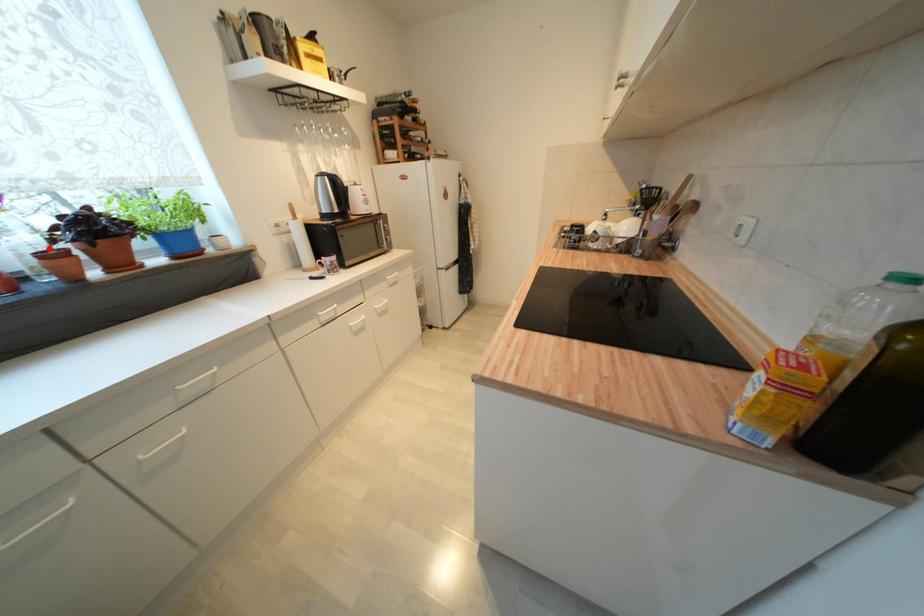
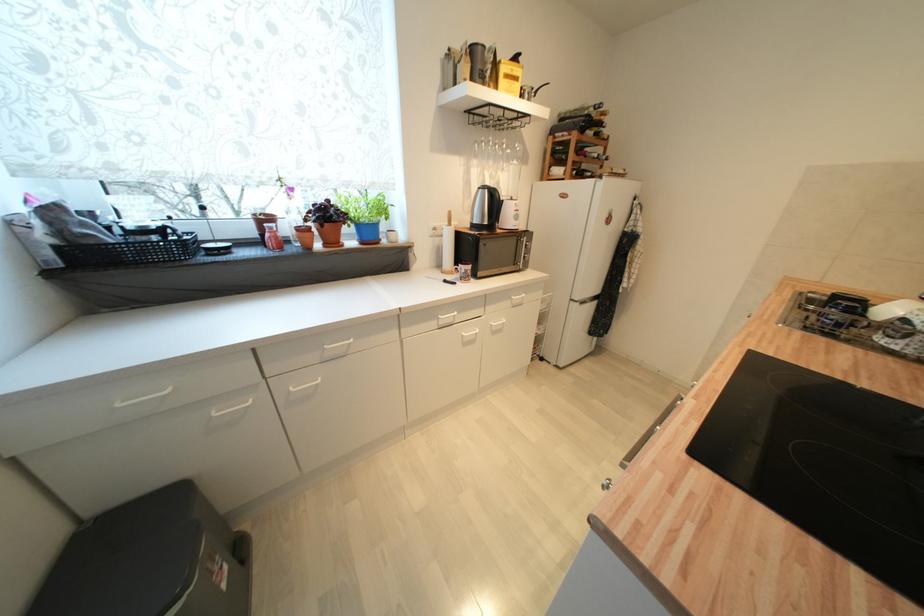
Question: I am providing you with two images of the same scene from different viewpoints. Image1 has a red point marked. In image2, the corresponding 3D location appears at what relative position? Reply with the corresponding letter.

Choices:
 (A) Closer
 (B) Farther

Answer: (A)